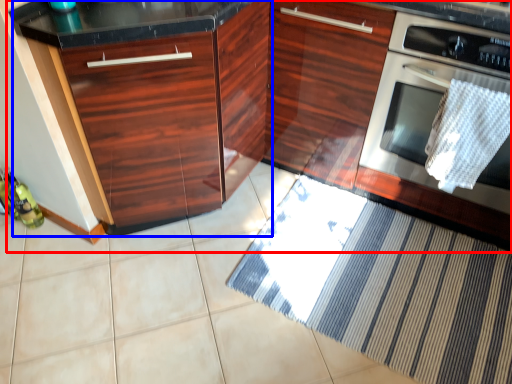
Question: Which object appears closest to the camera in this image, cabinetry (highlighted by a red box) or cabinetry (highlighted by a blue box)?

Choices:
 (A) cabinetry
 (B) cabinetry

Answer: (A)